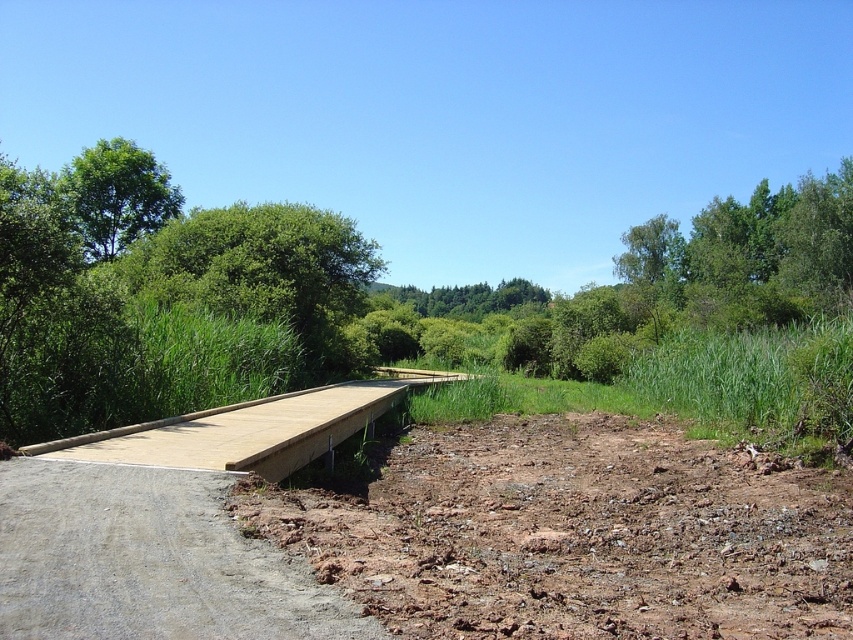
Is smooth concrete path at lower left positioned before light brown wooden bridge at center?

Yes, smooth concrete path at lower left is in front of light brown wooden bridge at center.

You are a GUI agent. You are given a task and a screenshot of the screen. Output one action in this format:
    pyautogui.click(x=<x>, y=<y>)
    Task: Click on the smooth concrete path at lower left
    
    Given the screenshot: What is the action you would take?
    pyautogui.click(x=148, y=561)

Identify the location of smooth concrete path at lower left. (148, 561).

Is smooth concrete path at lower left shorter than green leafy tree at upper left?

Correct, smooth concrete path at lower left is not as tall as green leafy tree at upper left.

Is point (318, 616) closer to viewer compared to point (112, 195)?

Yes.

Identify the location of smooth concrete path at lower left. This screenshot has width=853, height=640. (148, 561).

I want to click on smooth concrete path at lower left, so click(148, 561).

Is brown soil at lower right below light brown wooden bridge at center?

Yes, brown soil at lower right is below light brown wooden bridge at center.

Between brown soil at lower right and light brown wooden bridge at center, which one is positioned higher?

light brown wooden bridge at center is above.

Locate an element on the screen. brown soil at lower right is located at coordinates (576, 534).